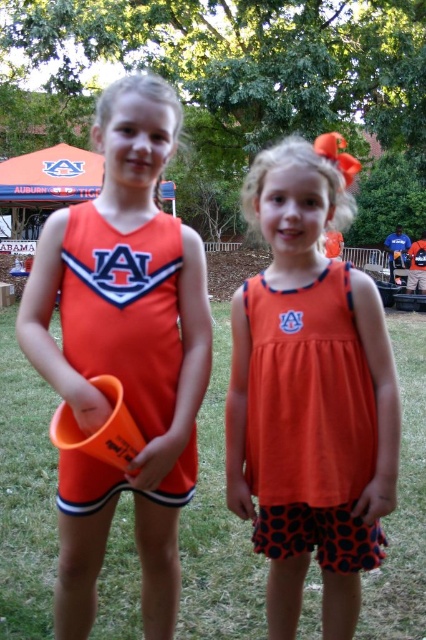
You are organizing a photo shoot and need to arrange the orange fabric dress at center and orange jersey at center so that they are both visible in the frame. Given their sizes, which one should be placed higher to ensure both are fully visible?

The orange fabric dress at center is not as tall as orange jersey at center, so to ensure both are fully visible, the orange fabric dress at center should be placed higher than the orange jersey at center.

You are a photographer trying to capture a candid shot of the two girls. Your camera has a focus range of 3 inches. Can you focus on both the matte orange cheerleading outfit at center and the orange jersey at center simultaneously?

The matte orange cheerleading outfit at center is 3.12 inches away from the orange jersey at center. Since the distance between them exceeds the camera focus range of 3 inches, you cannot focus on both simultaneously.

You are a photographer setting up for a group photo. You have two subjects wearing the matte orange cheerleading outfit at center and the orange fabric dress at center. If you want to ensure both subjects are fully visible in the frame, which outfit might require positioning the subject slightly further back to accommodate its width?

The matte orange cheerleading outfit at center might be wider than the orange fabric dress at center, so the subject wearing the matte orange cheerleading outfit at center should be positioned slightly further back to accommodate its width.